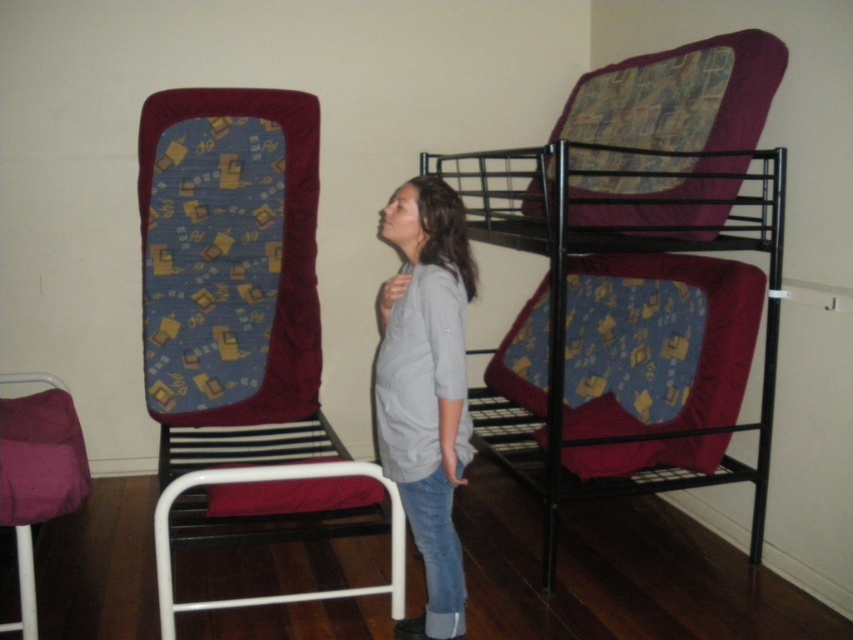
You are trying to reach a book that is on the top shelf of the maroon fabric bunk bed at right. You are currently standing on the gray matte shirt at center. Can you reach the book without moving the shirt?

The maroon fabric bunk bed at right is located above the gray matte shirt at center, so if you are standing on the gray matte shirt at center, you can reach the book on the top shelf of the maroon fabric bunk bed at right without needing to move the shirt.

You are a delivery person who needs to place a large package between the blue fabric chair at left and the bunk beds. The package is 2 meters long. Will there be enough space between them to fit the package?

The distance between the blue fabric chair at left and the bunk beds is 2.47 meters, which is greater than the package length of 2 meters. Yes, there is enough space to fit the package between them.